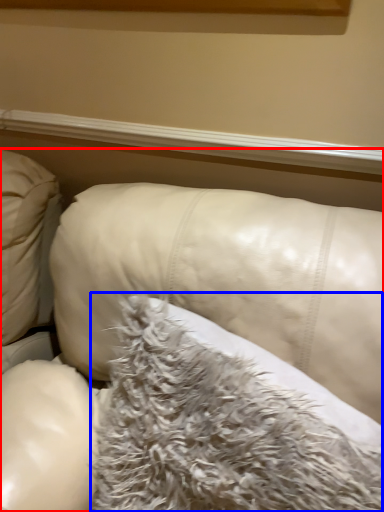
Question: Which object is closer to the camera taking this photo, furniture (highlighted by a red box) or pillow (highlighted by a blue box)?

Choices:
 (A) furniture
 (B) pillow

Answer: (A)